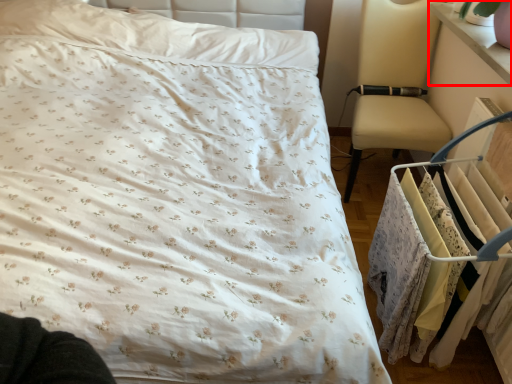
Question: From the image's perspective, considering the relative positions of changing table (annotated by the red box) and closet in the image provided, where is changing table (annotated by the red box) located with respect to the staircase?

Choices:
 (A) above
 (B) below

Answer: (A)